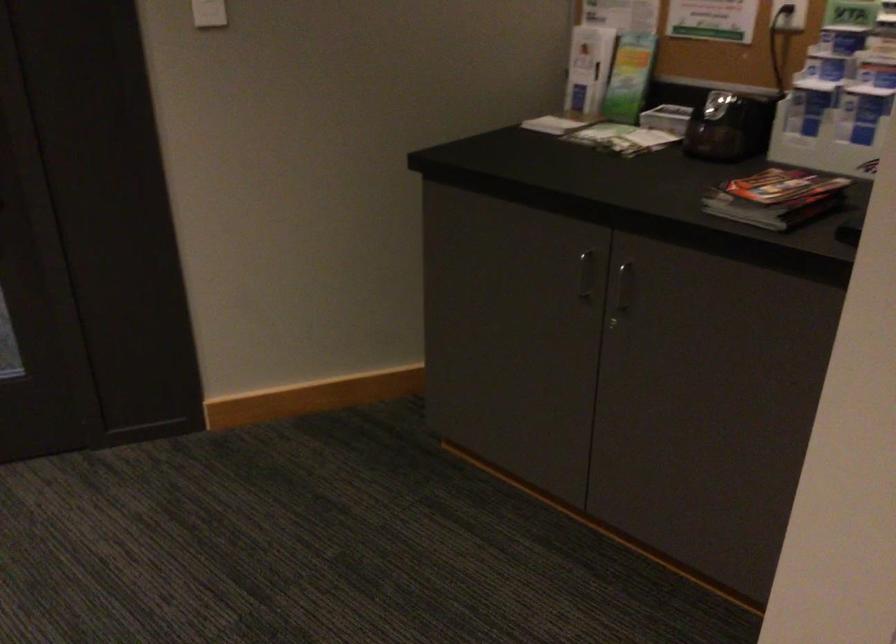
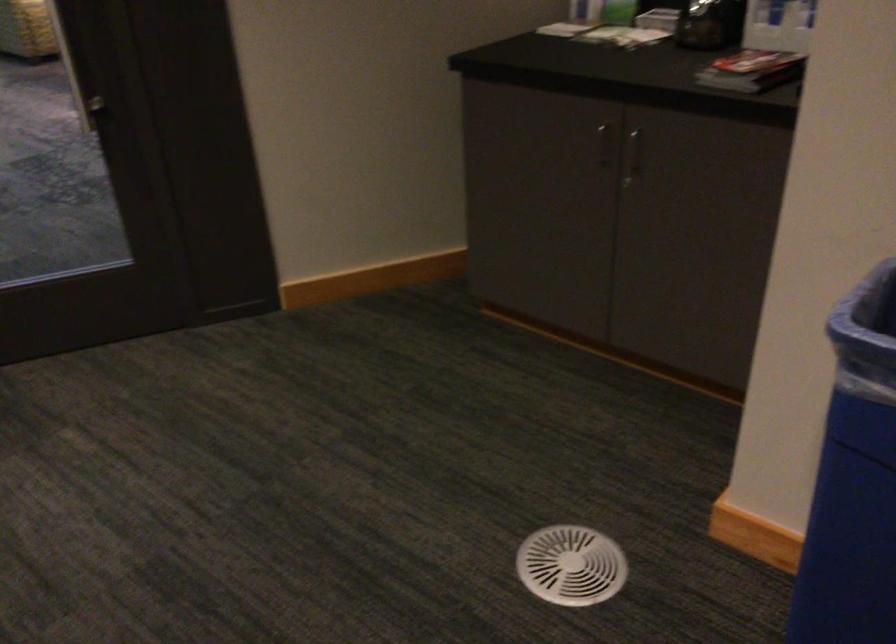
Locate, in the second image, the point that corresponds to point (776, 205) in the first image.

(751, 71)